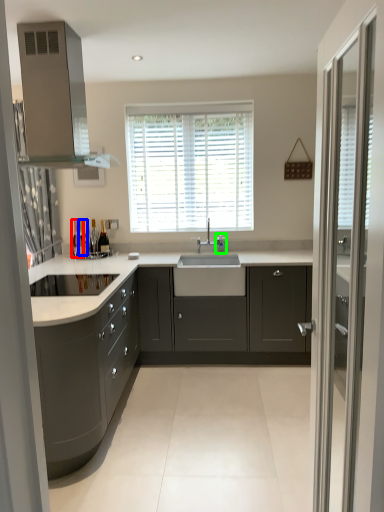
Question: Estimate the real-world distances between objects in this image. Which object is farther from bottle (highlighted by a red box), bottle (highlighted by a blue box) or faucet (highlighted by a green box)?

Choices:
 (A) bottle
 (B) faucet

Answer: (B)